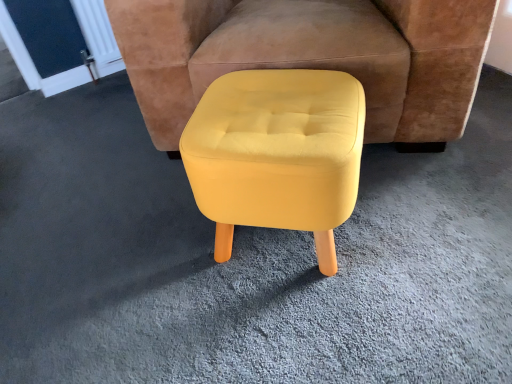
Question: Is point click(347, 175) positioned closer to the camera than point click(193, 4)?

Choices:
 (A) farther
 (B) closer

Answer: (B)

Question: Considering the positions of yellow fabric stool at center and yellow fabric ottoman at center in the image, is yellow fabric stool at center wider or thinner than yellow fabric ottoman at center?

Choices:
 (A) thin
 (B) wide

Answer: (A)

Question: In terms of height, does yellow fabric stool at center look taller or shorter compared to yellow fabric ottoman at center?

Choices:
 (A) tall
 (B) short

Answer: (B)

Question: Do you think yellow fabric ottoman at center is within yellow fabric stool at center, or outside of it?

Choices:
 (A) inside
 (B) outside

Answer: (B)

Question: Considering their positions, is yellow fabric ottoman at center located in front of or behind yellow fabric stool at center?

Choices:
 (A) behind
 (B) front

Answer: (A)

Question: From a real-world perspective, is yellow fabric ottoman at center positioned above or below yellow fabric stool at center?

Choices:
 (A) below
 (B) above

Answer: (B)

Question: Looking at their shapes, would you say yellow fabric ottoman at center is wider or thinner than yellow fabric stool at center?

Choices:
 (A) thin
 (B) wide

Answer: (B)